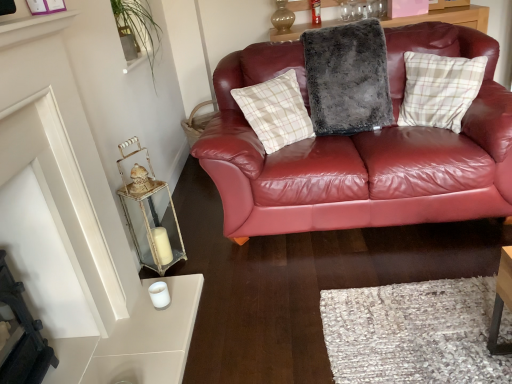
Locate an element on the screen. Image resolution: width=512 pixels, height=384 pixels. fuzzy gray pillow at center, which is counted as the second pillow, starting from the right is located at coordinates (347, 78).

What do you see at coordinates (153, 225) in the screenshot?
I see `metallic glass lantern at left` at bounding box center [153, 225].

Find the location of a particular element. plaid fabric pillow at upper right, acting as the 1th pillow starting from the right is located at coordinates (439, 89).

Which object is further away from the camera taking this photo, plaid fabric pillow at upper right, the 2th pillow from the left, or fuzzy gray pillow at center, the first pillow viewed from the left?

fuzzy gray pillow at center, the first pillow viewed from the left, is behind.

Is plaid fabric pillow at upper right, the 2th pillow from the left, thinner than fuzzy gray pillow at center, which is counted as the second pillow, starting from the right?

Yes, plaid fabric pillow at upper right, the 2th pillow from the left, is thinner than fuzzy gray pillow at center, which is counted as the second pillow, starting from the right.

How different are the orientations of plaid fabric pillow at upper right, the 2th pillow from the left, and fuzzy gray pillow at center, which is counted as the second pillow, starting from the right, in degrees?

The facing directions of plaid fabric pillow at upper right, the 2th pillow from the left, and fuzzy gray pillow at center, which is counted as the second pillow, starting from the right, are 51.4 degrees apart.

Considering the relative positions of plaid fabric pillow at upper right, acting as the 1th pillow starting from the right, and fuzzy gray pillow at center, which is counted as the second pillow, starting from the right, in the image provided, is plaid fabric pillow at upper right, acting as the 1th pillow starting from the right, to the left of fuzzy gray pillow at center, which is counted as the second pillow, starting from the right, from the viewer's perspective?

In fact, plaid fabric pillow at upper right, acting as the 1th pillow starting from the right, is to the right of fuzzy gray pillow at center, which is counted as the second pillow, starting from the right.

In the scene shown: Considering the relative sizes of metallic glass lantern at left and white glossy shelf at upper left in the image provided, is metallic glass lantern at left bigger than white glossy shelf at upper left?

Correct, metallic glass lantern at left is larger in size than white glossy shelf at upper left.

Are metallic glass lantern at left and white glossy shelf at upper left making contact?

metallic glass lantern at left and white glossy shelf at upper left are not in contact.

Considering the sizes of objects metallic glass lantern at left and white glossy shelf at upper left in the image provided, who is shorter, metallic glass lantern at left or white glossy shelf at upper left?

white glossy shelf at upper left.

Is fuzzy gray pillow at center, the first pillow viewed from the left, to the left or to the right of white glossy shelf at upper left in the image?

Based on their positions, fuzzy gray pillow at center, the first pillow viewed from the left, is located to the right of white glossy shelf at upper left.

How different are the orientations of fuzzy gray pillow at center, which is counted as the second pillow, starting from the right, and white glossy shelf at upper left in degrees?

86.5 degrees.

Does fuzzy gray pillow at center, the first pillow viewed from the left, have a larger size compared to white glossy shelf at upper left?

Correct, fuzzy gray pillow at center, the first pillow viewed from the left, is larger in size than white glossy shelf at upper left.

Would you say fuzzy gray pillow at center, the first pillow viewed from the left, is inside or outside white glossy shelf at upper left?

fuzzy gray pillow at center, the first pillow viewed from the left, cannot be found inside white glossy shelf at upper left.

How different are the orientations of fuzzy gray pillow at center, the first pillow viewed from the left, and plaid fabric pillow at upper right, the 2th pillow from the left, in degrees?

There is a 51.4-degree angle between the facing directions of fuzzy gray pillow at center, the first pillow viewed from the left, and plaid fabric pillow at upper right, the 2th pillow from the left.

Is fuzzy gray pillow at center, the first pillow viewed from the left, situated inside plaid fabric pillow at upper right, acting as the 1th pillow starting from the right, or outside?

fuzzy gray pillow at center, the first pillow viewed from the left, lies outside plaid fabric pillow at upper right, acting as the 1th pillow starting from the right.

Is fuzzy gray pillow at center, the first pillow viewed from the left, not near plaid fabric pillow at upper right, the 2th pillow from the left?

No.

Considering the points (336, 131) and (482, 69), which point is in front, point (336, 131) or point (482, 69)?

The point (482, 69) is closer.

Where is `the 1st pillow behind the white glossy shelf at upper left`? The height and width of the screenshot is (384, 512). the 1st pillow behind the white glossy shelf at upper left is located at coordinates (439, 89).

Is point (15, 24) closer to viewer compared to point (410, 86)?

Yes, point (15, 24) is closer to viewer.

Which of these two, white glossy shelf at upper left or plaid fabric pillow at upper right, the 2th pillow from the left, is bigger?

plaid fabric pillow at upper right, the 2th pillow from the left.

From the image's perspective, relative to plaid fabric pillow at upper right, acting as the 1th pillow starting from the right, is white glossy shelf at upper left above or below?

white glossy shelf at upper left is situated lower than plaid fabric pillow at upper right, acting as the 1th pillow starting from the right, in the image.

Is fuzzy gray pillow at center, which is counted as the second pillow, starting from the right, far away from metallic glass lantern at left?

Yes, fuzzy gray pillow at center, which is counted as the second pillow, starting from the right, and metallic glass lantern at left are located far from each other.

Considering the sizes of fuzzy gray pillow at center, which is counted as the second pillow, starting from the right, and metallic glass lantern at left in the image, is fuzzy gray pillow at center, which is counted as the second pillow, starting from the right, taller or shorter than metallic glass lantern at left?

fuzzy gray pillow at center, which is counted as the second pillow, starting from the right, is shorter than metallic glass lantern at left.

Considering the relative sizes of fuzzy gray pillow at center, which is counted as the second pillow, starting from the right, and metallic glass lantern at left in the image provided, is fuzzy gray pillow at center, which is counted as the second pillow, starting from the right, smaller than metallic glass lantern at left?

No.

Is white glossy shelf at upper left in front of or behind fuzzy gray pillow at center, which is counted as the second pillow, starting from the right, in the image?

Clearly, white glossy shelf at upper left is in front of fuzzy gray pillow at center, which is counted as the second pillow, starting from the right.

Is white glossy shelf at upper left facing away from fuzzy gray pillow at center, which is counted as the second pillow, starting from the right?

That's not correct — white glossy shelf at upper left is not looking away from fuzzy gray pillow at center, which is counted as the second pillow, starting from the right.

From a real-world perspective, who is located higher, white glossy shelf at upper left or fuzzy gray pillow at center, which is counted as the second pillow, starting from the right?

white glossy shelf at upper left is physically above.

This screenshot has height=384, width=512. I want to click on pillow located in front of the fuzzy gray pillow at center, the first pillow viewed from the left, so click(x=439, y=89).

In the image, there is a white glossy shelf at upper left. Identify the location of table below it (from the image's perspective). pos(153,225).

From the image, which object appears to be farther from plaid fabric pillow at upper right, the 2th pillow from the left, white glossy shelf at upper left or fuzzy gray pillow at center, which is counted as the second pillow, starting from the right?

white glossy shelf at upper left is positioned further to the anchor plaid fabric pillow at upper right, the 2th pillow from the left.

When comparing their distances from metallic glass lantern at left, does white glossy shelf at upper left or plaid fabric pillow at upper right, the 2th pillow from the left, seem closer?

white glossy shelf at upper left.

From the image, which object appears to be nearer to metallic glass lantern at left, white glossy shelf at upper left or fuzzy gray pillow at center, the first pillow viewed from the left?

white glossy shelf at upper left lies closer to metallic glass lantern at left than the other object.

Estimate the real-world distances between objects in this image. Which object is closer to metallic glass lantern at left, fuzzy gray pillow at center, which is counted as the second pillow, starting from the right, or white glossy shelf at upper left?

white glossy shelf at upper left lies closer to metallic glass lantern at left than the other object.

Estimate the real-world distances between objects in this image. Which object is further from white glossy shelf at upper left, metallic glass lantern at left or fuzzy gray pillow at center, which is counted as the second pillow, starting from the right?

Among the two, fuzzy gray pillow at center, which is counted as the second pillow, starting from the right, is located further to white glossy shelf at upper left.

From the image, which object appears to be farther from white glossy shelf at upper left, fuzzy gray pillow at center, the first pillow viewed from the left, or metallic glass lantern at left?

Based on the image, fuzzy gray pillow at center, the first pillow viewed from the left, appears to be further to white glossy shelf at upper left.

Considering their positions, is metallic glass lantern at left positioned closer to plaid fabric pillow at upper right, the 2th pillow from the left, than fuzzy gray pillow at center, which is counted as the second pillow, starting from the right?

fuzzy gray pillow at center, which is counted as the second pillow, starting from the right.

Which object lies nearer to the anchor point fuzzy gray pillow at center, the first pillow viewed from the left, plaid fabric pillow at upper right, acting as the 1th pillow starting from the right, or metallic glass lantern at left?

Based on the image, plaid fabric pillow at upper right, acting as the 1th pillow starting from the right, appears to be nearer to fuzzy gray pillow at center, the first pillow viewed from the left.

Identify the location of pillow between white glossy shelf at upper left and plaid fabric pillow at upper right, acting as the 1th pillow starting from the right. (347, 78).

The height and width of the screenshot is (384, 512). I want to click on table between white glossy shelf at upper left and fuzzy gray pillow at center, which is counted as the second pillow, starting from the right, in the horizontal direction, so click(x=153, y=225).

Find the location of a particular element. Image resolution: width=512 pixels, height=384 pixels. pillow located between metallic glass lantern at left and plaid fabric pillow at upper right, acting as the 1th pillow starting from the right, in the left-right direction is located at coordinates (347, 78).

You are a GUI agent. You are given a task and a screenshot of the screen. Output one action in this format:
    pyautogui.click(x=<x>, y=<y>)
    Task: Click on the table situated between white glossy shelf at upper left and plaid fabric pillow at upper right, the 2th pillow from the left, from left to right
    
    Given the screenshot: What is the action you would take?
    pyautogui.click(x=153, y=225)